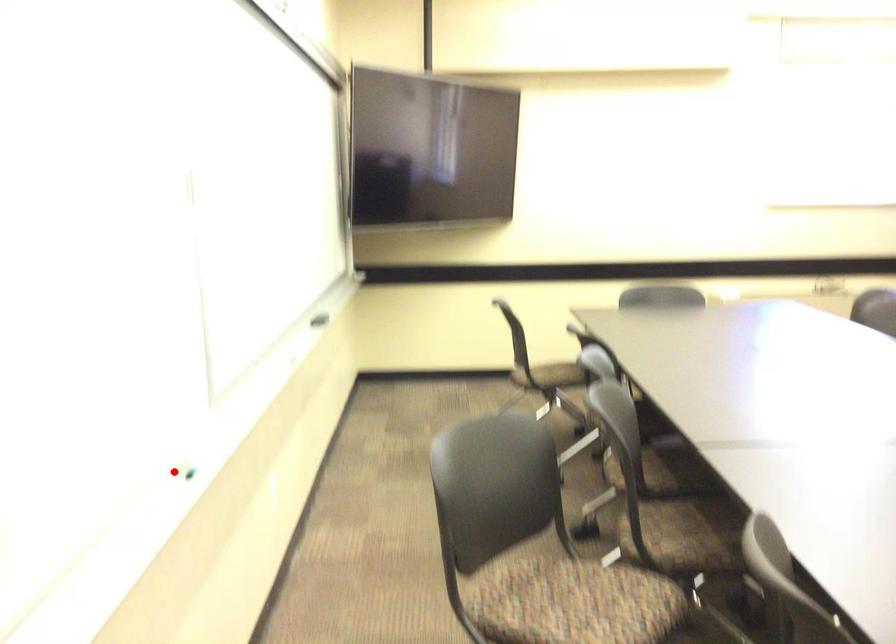
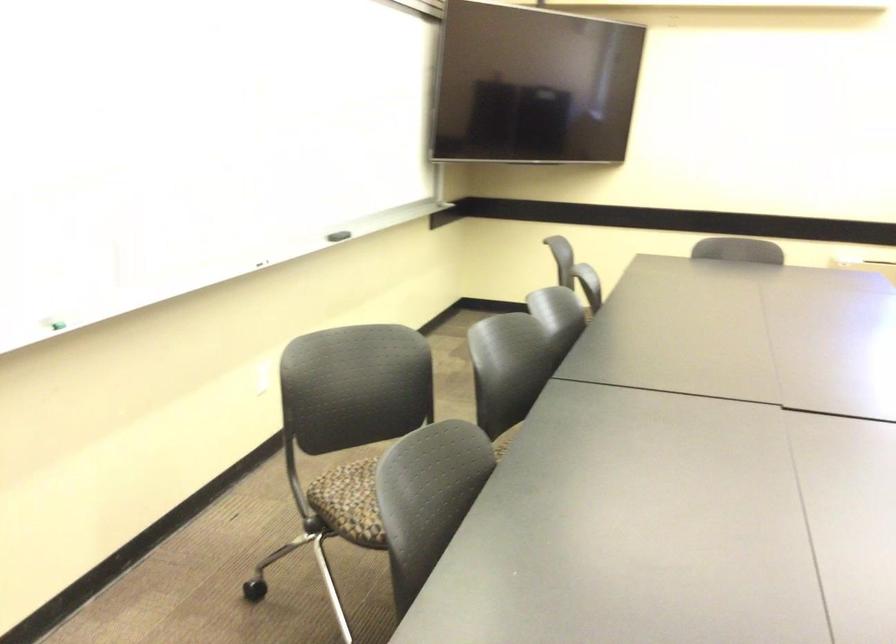
Find the pixel in the second image that matches the highlighted location in the first image.

(55, 325)